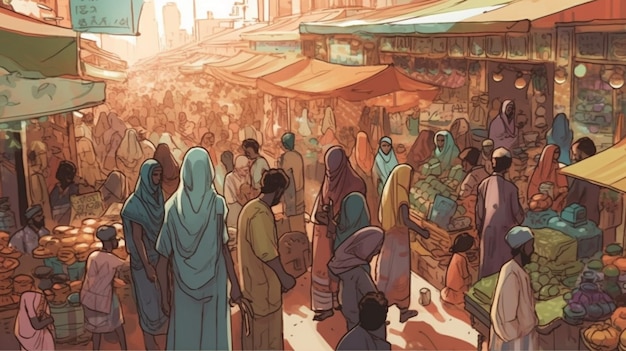
This screenshot has width=626, height=351. I want to click on lights, so (x=519, y=81), (x=581, y=75), (x=616, y=82), (x=495, y=74).